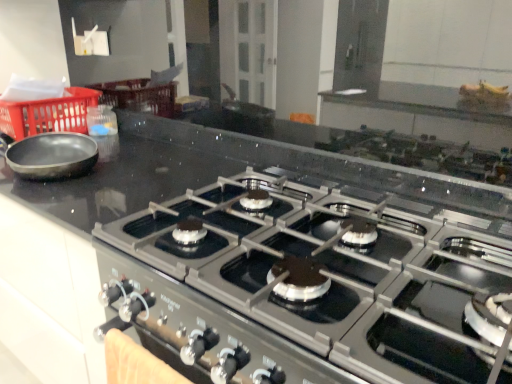
Question: Is the depth of red plastic basket at left less than that of black stainless steel gas stove at center?

Choices:
 (A) yes
 (B) no

Answer: (B)

Question: Can you confirm if red plastic basket at left is wider than black stainless steel gas stove at center?

Choices:
 (A) no
 (B) yes

Answer: (A)

Question: Are red plastic basket at left and black stainless steel gas stove at center far apart?

Choices:
 (A) yes
 (B) no

Answer: (A)

Question: Can you confirm if red plastic basket at left is positioned to the right of black stainless steel gas stove at center?

Choices:
 (A) no
 (B) yes

Answer: (A)

Question: From the image's perspective, is red plastic basket at left over black stainless steel gas stove at center?

Choices:
 (A) no
 (B) yes

Answer: (B)

Question: Is red plastic basket at left smaller than black stainless steel gas stove at center?

Choices:
 (A) yes
 (B) no

Answer: (A)

Question: Is red plastic basket at left at the back of black stainless steel gas stove at center?

Choices:
 (A) no
 (B) yes

Answer: (A)

Question: Is black stainless steel gas stove at center thinner than red plastic basket at left?

Choices:
 (A) yes
 (B) no

Answer: (B)

Question: From a real-world perspective, is black stainless steel gas stove at center on red plastic basket at left?

Choices:
 (A) yes
 (B) no

Answer: (B)

Question: Is black stainless steel gas stove at center far away from red plastic basket at left?

Choices:
 (A) yes
 (B) no

Answer: (A)

Question: Is black stainless steel gas stove at center smaller than red plastic basket at left?

Choices:
 (A) no
 (B) yes

Answer: (A)

Question: Is black stainless steel gas stove at center closer to the viewer compared to red plastic basket at left?

Choices:
 (A) yes
 (B) no

Answer: (A)

Question: In terms of width, does red plastic basket at left look wider or thinner when compared to black stainless steel gas stove at center?

Choices:
 (A) wide
 (B) thin

Answer: (B)